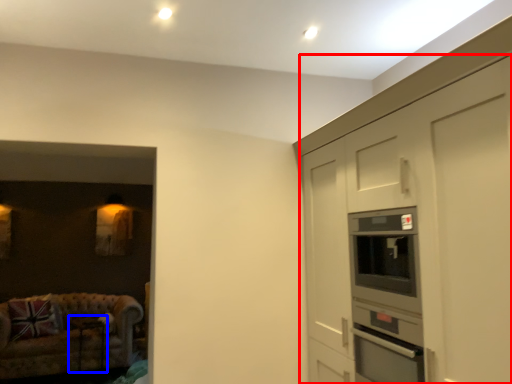
Question: Which of the following is the farthest to the observer, cabinetry (highlighted by a red box) or table (highlighted by a blue box)?

Choices:
 (A) cabinetry
 (B) table

Answer: (B)